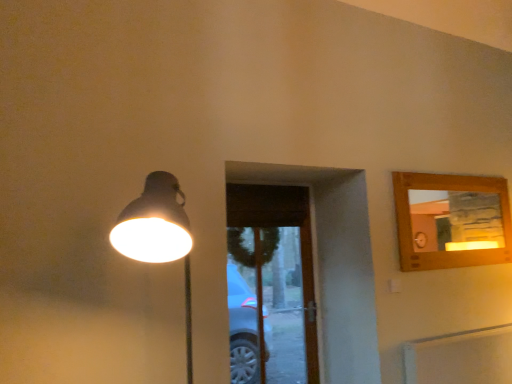
Question: Based on their sizes in the image, would you say matte black lamp at left is bigger or smaller than transparent glass door at center?

Choices:
 (A) small
 (B) big

Answer: (B)

Question: Is matte black lamp at left in front of or behind transparent glass door at center in the image?

Choices:
 (A) front
 (B) behind

Answer: (A)

Question: From the image's perspective, is matte black lamp at left positioned above or below transparent glass door at center?

Choices:
 (A) above
 (B) below

Answer: (A)

Question: In terms of height, does transparent glass door at center look taller or shorter compared to matte black lamp at left?

Choices:
 (A) short
 (B) tall

Answer: (B)

Question: From a real-world perspective, is transparent glass door at center positioned above or below matte black lamp at left?

Choices:
 (A) below
 (B) above

Answer: (A)

Question: Considering the relative positions of transparent glass door at center and matte black lamp at left in the image provided, is transparent glass door at center to the left or to the right of matte black lamp at left?

Choices:
 (A) right
 (B) left

Answer: (A)

Question: Is transparent glass door at center inside the boundaries of matte black lamp at left, or outside?

Choices:
 (A) outside
 (B) inside

Answer: (A)